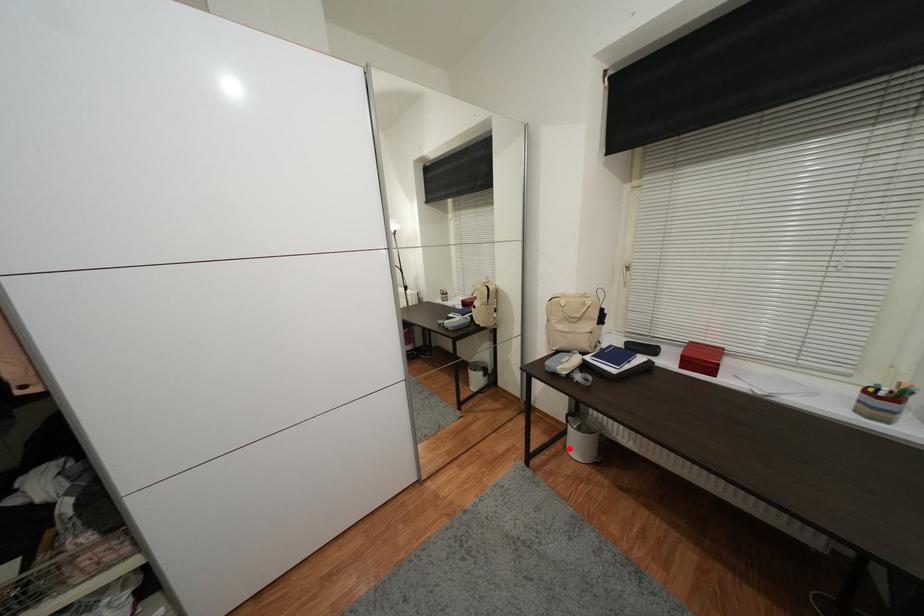
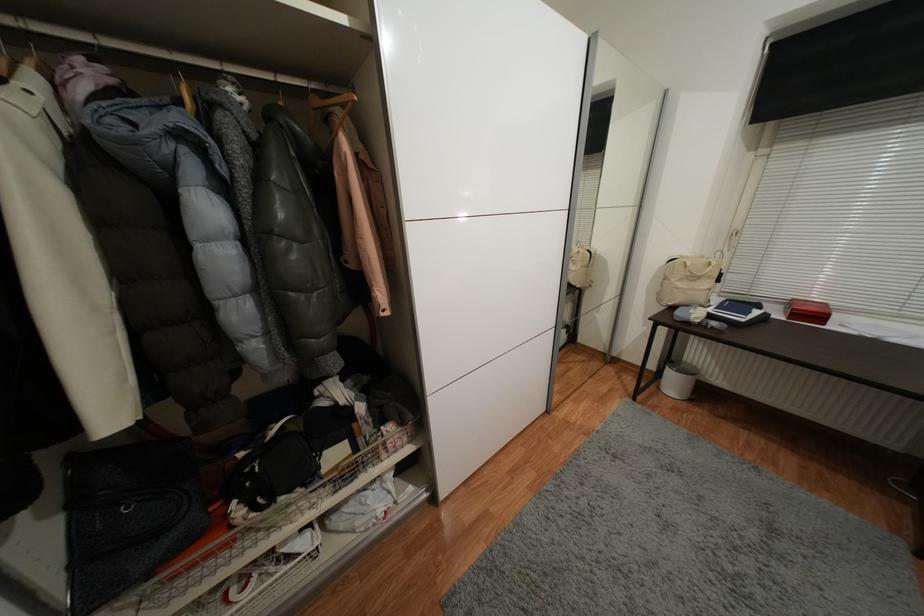
In the second image, find the point that corresponds to the highlighted location in the first image.

(663, 390)